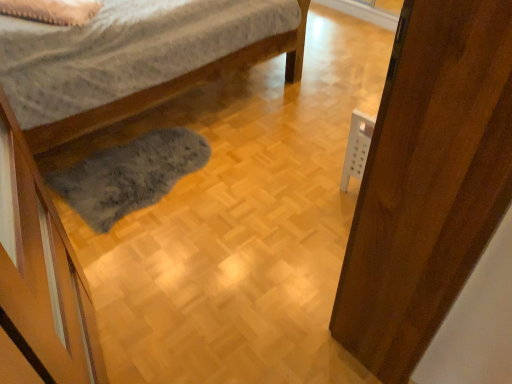
Describe the element at coordinates (52, 10) in the screenshot. I see `white soft pillow at upper left` at that location.

Locate an element on the screen. The height and width of the screenshot is (384, 512). white soft pillow at upper left is located at coordinates (52, 10).

Where is `wooden door at right`? wooden door at right is located at coordinates (428, 181).

What do you see at coordinates (428, 181) in the screenshot? I see `wooden door at right` at bounding box center [428, 181].

Find the location of a particular element. The width and height of the screenshot is (512, 384). white soft pillow at upper left is located at coordinates (52, 10).

Is wooden door at right to the right of white soft pillow at upper left from the viewer's perspective?

Yes, wooden door at right is to the right of white soft pillow at upper left.

Is wooden door at right positioned in front of white soft pillow at upper left?

That is True.

Between point (359, 248) and point (46, 16), which one is positioned in front?

The point (359, 248) is closer.

From the image's perspective, which is below, wooden door at right or white soft pillow at upper left?

wooden door at right appears lower in the image.

From a real-world perspective, is wooden door at right located beneath white soft pillow at upper left?

Yes, from a real-world perspective, wooden door at right is under white soft pillow at upper left.

Looking at their sizes, would you say wooden door at right is wider or thinner than white soft pillow at upper left?

In the image, wooden door at right appears to be more narrow than white soft pillow at upper left.

Considering the relative sizes of wooden door at right and white soft pillow at upper left in the image provided, is wooden door at right shorter than white soft pillow at upper left?

No.

Considering the sizes of objects wooden door at right and white soft pillow at upper left in the image provided, who is smaller, wooden door at right or white soft pillow at upper left?

With smaller size is white soft pillow at upper left.

Is white soft pillow at upper left surrounded by wooden door at right?

No, white soft pillow at upper left is located outside of wooden door at right.

Is wooden door at right next to white soft pillow at upper left?

wooden door at right is not next to white soft pillow at upper left, and they're not touching.

Is wooden door at right oriented towards white soft pillow at upper left?

No, wooden door at right does not turn towards white soft pillow at upper left.

This screenshot has height=384, width=512. In order to click on door located underneath the white soft pillow at upper left (from a real-world perspective) in this screenshot , I will do `click(428, 181)`.

Considering the relative positions of white soft pillow at upper left and wooden door at right in the image provided, is white soft pillow at upper left to the left of wooden door at right from the viewer's perspective?

Yes, white soft pillow at upper left is to the left of wooden door at right.

In the image, is white soft pillow at upper left positioned in front of or behind wooden door at right?

Visually, white soft pillow at upper left is located behind wooden door at right.

Which is closer to the camera, (x=84, y=10) or (x=467, y=87)?

The point (x=467, y=87) is closer to the camera.

From the image's perspective, is white soft pillow at upper left below wooden door at right?

No.

From a real-world perspective, is white soft pillow at upper left under wooden door at right?

Actually, white soft pillow at upper left is physically above wooden door at right in the real world.

Looking at their sizes, would you say white soft pillow at upper left is wider or thinner than wooden door at right?

Clearly, white soft pillow at upper left has more width compared to wooden door at right.

In terms of height, does white soft pillow at upper left look taller or shorter compared to wooden door at right?

In the image, white soft pillow at upper left appears to be shorter than wooden door at right.

Is white soft pillow at upper left bigger than wooden door at right?

No, white soft pillow at upper left is not bigger than wooden door at right.

Is wooden door at right inside white soft pillow at upper left?

No, wooden door at right is located outside of white soft pillow at upper left.

Are white soft pillow at upper left and wooden door at right located far from each other?

Yes.

Could you tell me if white soft pillow at upper left is turned towards wooden door at right?

No, white soft pillow at upper left does not turn towards wooden door at right.

In the scene shown: How different are the orientations of white soft pillow at upper left and wooden door at right in degrees?

They differ by 140 degrees in their facing directions.

The width and height of the screenshot is (512, 384). There is a wooden door at right. What are the coordinates of `pillow above it (from a real-world perspective)` in the screenshot? It's located at (52, 10).

This screenshot has width=512, height=384. What are the coordinates of `door below the white soft pillow at upper left (from a real-world perspective)` in the screenshot? It's located at (428, 181).

You are a GUI agent. You are given a task and a screenshot of the screen. Output one action in this format:
    pyautogui.click(x=<x>, y=<y>)
    Task: Click on the door lying below the white soft pillow at upper left (from the image's perspective)
    Image resolution: width=512 pixels, height=384 pixels.
    Given the screenshot: What is the action you would take?
    pyautogui.click(x=428, y=181)